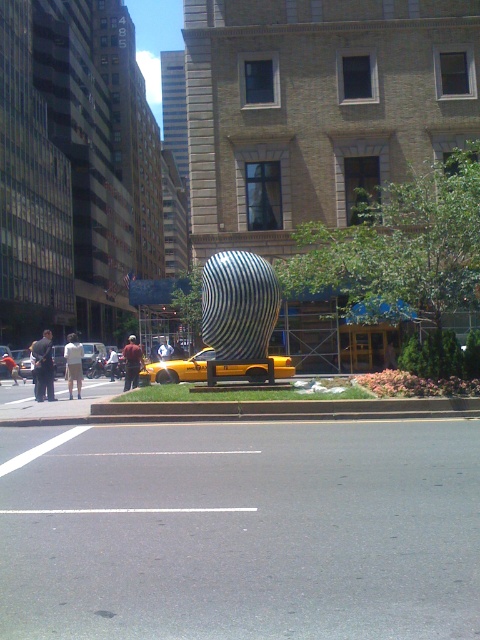
Question: Which point is closer to the camera?

Choices:
 (A) dark gray jacket at left
 (B) dark gray pants at lower left

Answer: (A)

Question: Does dark gray jacket at left have a smaller size compared to white cotton shirt at center?

Choices:
 (A) yes
 (B) no

Answer: (B)

Question: Based on their relative distances, which object is farther from the dark brown leather jacket at center?

Choices:
 (A) dark gray jacket at left
 (B) white cotton shirt at center
 (C) yellow matte taxi at center
 (D) dark gray pants at center

Answer: (D)

Question: Which point is closer to the camera?

Choices:
 (A) (17, 368)
 (B) (111, 349)
 (C) (135, 349)

Answer: (C)

Question: Can you confirm if dark gray jacket at left is positioned to the right of white cotton shirt at center?

Choices:
 (A) yes
 (B) no

Answer: (B)

Question: Observing the image, what is the correct spatial positioning of yellow matte taxi at center in reference to khaki shorts at center?

Choices:
 (A) left
 (B) right

Answer: (B)